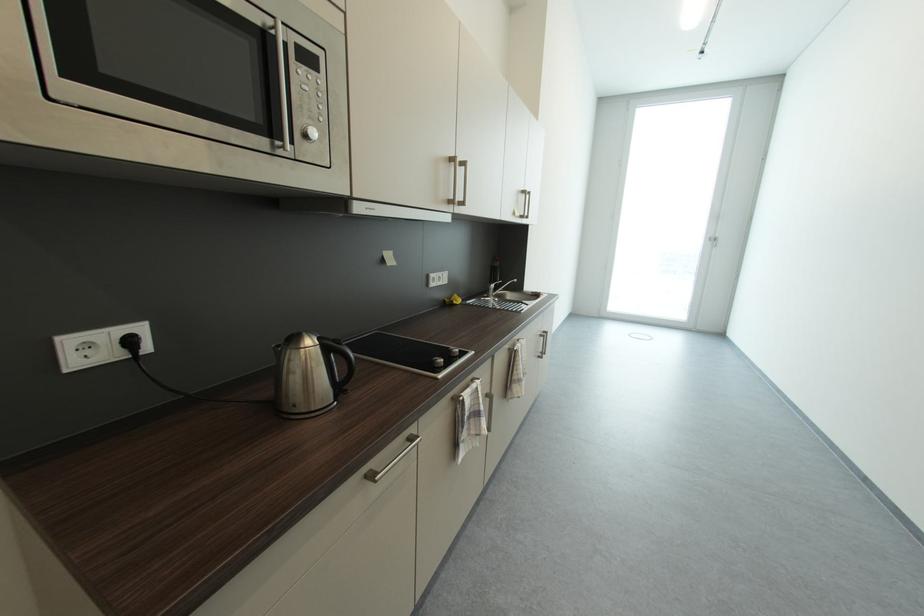
Where is `kettle handle`? Image resolution: width=924 pixels, height=616 pixels. kettle handle is located at coordinates pyautogui.click(x=339, y=358).